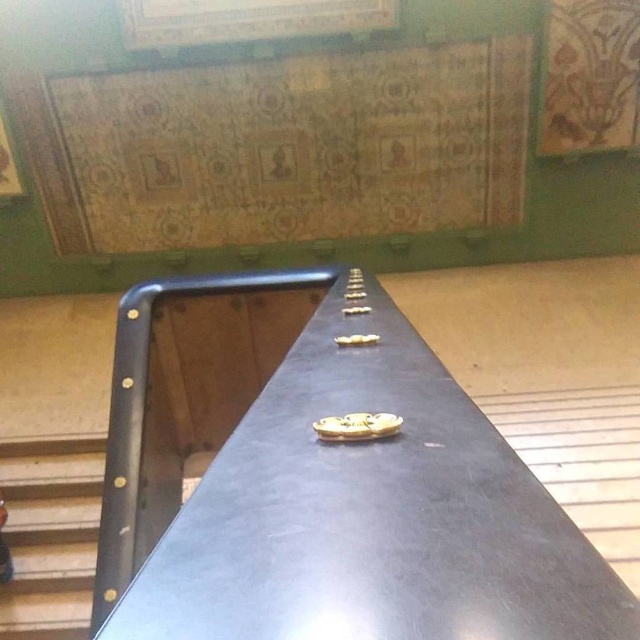
Question: Which of the following is the farthest from the observer?

Choices:
 (A) wooden bulletin board at upper center
 (B) wooden stairs at lower left

Answer: (A)

Question: Is wooden stairs at lower left above wooden bulletin board at upper center?

Choices:
 (A) yes
 (B) no

Answer: (B)

Question: Which object is closer to the camera taking this photo?

Choices:
 (A) wooden bulletin board at upper center
 (B) smooth gray stair at center

Answer: (B)

Question: Estimate the real-world distances between objects in this image. Which object is closer to the wooden stairs at lower left?

Choices:
 (A) smooth gray stair at center
 (B) wooden bulletin board at upper center

Answer: (A)

Question: Can you confirm if wooden stairs at lower left is bigger than smooth gray stair at center?

Choices:
 (A) yes
 (B) no

Answer: (B)

Question: Can you confirm if wooden stairs at lower left is smaller than wooden bulletin board at upper center?

Choices:
 (A) yes
 (B) no

Answer: (B)